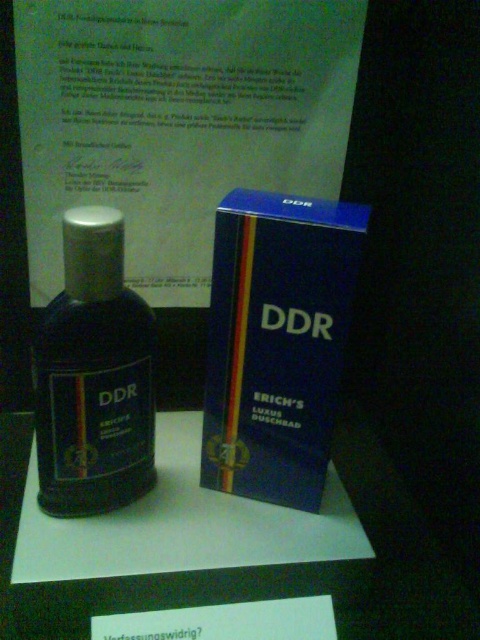
You are a customer at a DDR product store. You see two points on the packaging of the product labeled DDR. The first point is at coordinate (218, 397) and the second is at (314, 566). Which point is closer to you?

Point (218, 397) is closer to you because it is further to the camera than point (314, 566).

You are standing in front of the blue matte box at center. The box is part of a DDR product display. If your arm reaches out to grab the box, can you comfortably reach it without moving your feet? Assume your arm can extend 60 centimeters.

The blue matte box at center is 57.00 centimeters away from the viewer. Since your arm can extend 60 centimeters, you can comfortably reach the blue matte box at center without moving your feet.